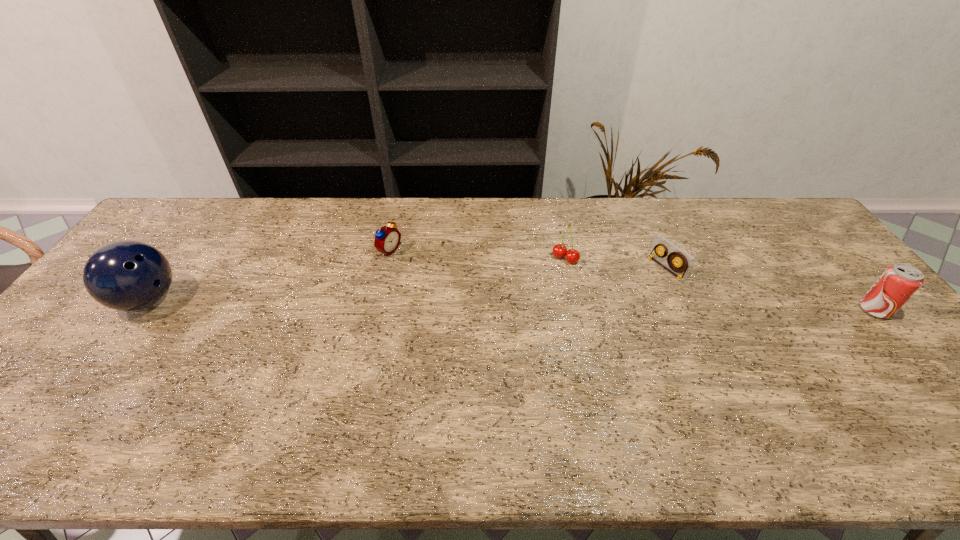
Identify the location of the leftmost object. (127, 275).

This screenshot has width=960, height=540. Identify the location of the tallest object. (127, 275).

This screenshot has height=540, width=960. In order to click on the fourth shortest object in this screenshot , I will do `click(899, 282)`.

Identify the location of the rightmost object. The height and width of the screenshot is (540, 960). (899, 282).

The width and height of the screenshot is (960, 540). Find the location of `alarm clock`. alarm clock is located at coordinates (387, 239).

Find the location of `cherry`. cherry is located at coordinates (572, 256).

This screenshot has height=540, width=960. Find the location of `the fourth object from left to right`. the fourth object from left to right is located at coordinates (685, 260).

The width and height of the screenshot is (960, 540). I want to click on videotape, so [685, 260].

This screenshot has height=540, width=960. I want to click on vacant region located on the surface of the leftmost object near the finger holes, so click(284, 300).

Where is `vacant space located on the left of the rightmost object`? vacant space located on the left of the rightmost object is located at coordinates (817, 310).